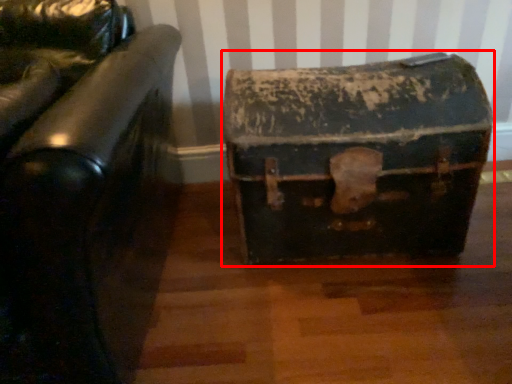
Question: Considering the relative positions of suitcase (annotated by the red box) and furniture in the image provided, where is suitcase (annotated by the red box) located with respect to the staircase?

Choices:
 (A) right
 (B) left

Answer: (A)